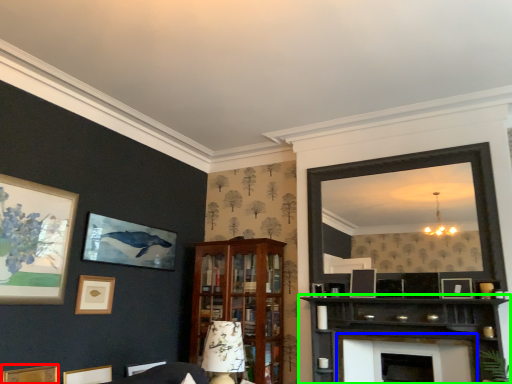
Question: Estimate the real-world distances between objects in this image. Which object is closer to picture frame (highlighted by a red box), fireplace (highlighted by a blue box) or shelf (highlighted by a green box)?

Choices:
 (A) fireplace
 (B) shelf

Answer: (B)